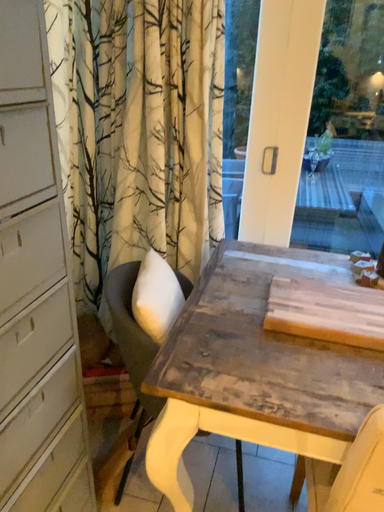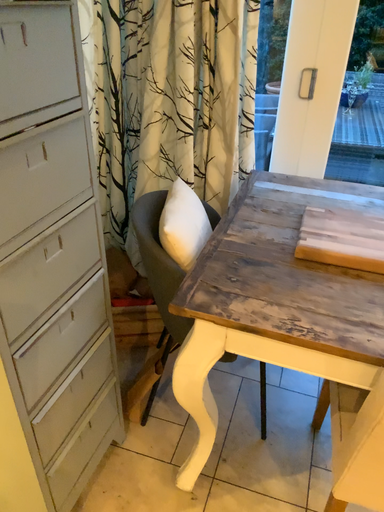
Question: How did the camera likely rotate when shooting the video?

Choices:
 (A) rotated upward
 (B) rotated downward

Answer: (B)